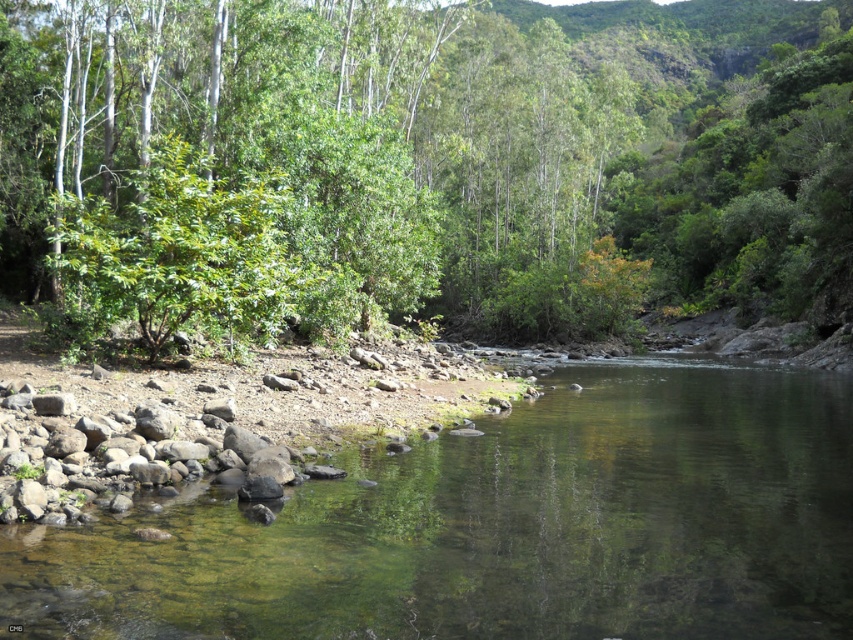
Between green leafy tree at upper center and clear water at river center, which one is positioned lower?

clear water at river center is lower down.

Is green leafy tree at upper center to the right of clear water at river center from the viewer's perspective?

Yes, green leafy tree at upper center is to the right of clear water at river center.

The image size is (853, 640). I want to click on green leafy tree at upper center, so click(x=433, y=157).

Is point (740, 182) closer to viewer compared to point (177, 458)?

No.

Is point (111, 268) positioned behind point (120, 436)?

That is True.

Locate an element on the screen. Image resolution: width=853 pixels, height=640 pixels. green leafy tree at upper center is located at coordinates (433, 157).

Which is more to the right, clear water at river center or gray smooth rocks at lower left?

Positioned to the right is clear water at river center.

Can you confirm if clear water at river center is positioned to the left of gray smooth rocks at lower left?

No, clear water at river center is not to the left of gray smooth rocks at lower left.

What are the coordinates of `clear water at river center` in the screenshot? It's located at (503, 528).